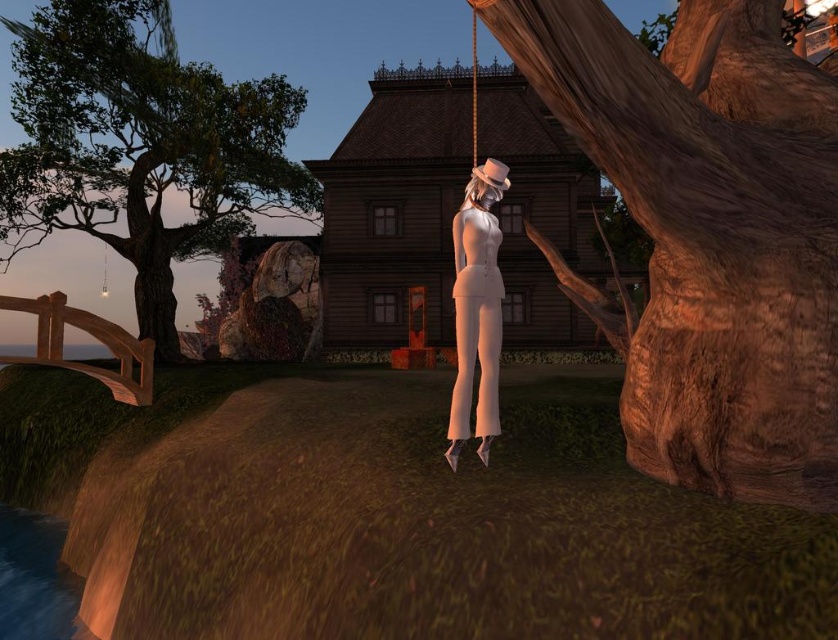
Can you confirm if green leafy tree at left is taller than white matte suit at center?

Yes, green leafy tree at left is taller than white matte suit at center.

Is green leafy tree at left thinner than white matte suit at center?

No, green leafy tree at left is not thinner than white matte suit at center.

You are a GUI agent. You are given a task and a screenshot of the screen. Output one action in this format:
    pyautogui.click(x=<x>, y=<y>)
    Task: Click on the green leafy tree at left
    This screenshot has width=838, height=640.
    Given the screenshot: What is the action you would take?
    pyautogui.click(x=141, y=145)

Which is in front, point (769, 147) or point (40, 86)?

Point (769, 147)

The width and height of the screenshot is (838, 640). Identify the location of smooth brown bark at center right. (710, 232).

Measure the distance between smooth brown bark at center right and camera.

smooth brown bark at center right is 2.86 meters away from camera.

Identify the location of smooth brown bark at center right. (710, 232).

Does smooth brown bark at center right lie in front of white matte suit at center?

Yes.

Where is `smooth brown bark at center right`? smooth brown bark at center right is located at coordinates (710, 232).